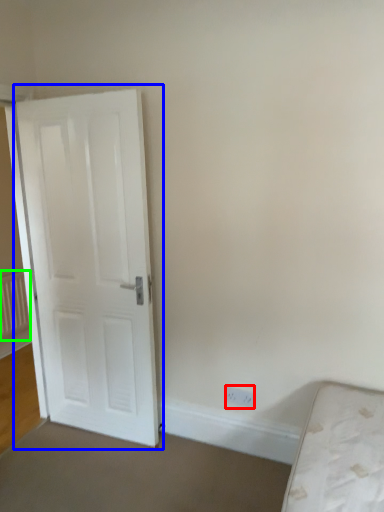
Question: Which is farther away from electric outlet (highlighted by a red box)? door (highlighted by a blue box) or radiator (highlighted by a green box)?

Choices:
 (A) door
 (B) radiator

Answer: (B)